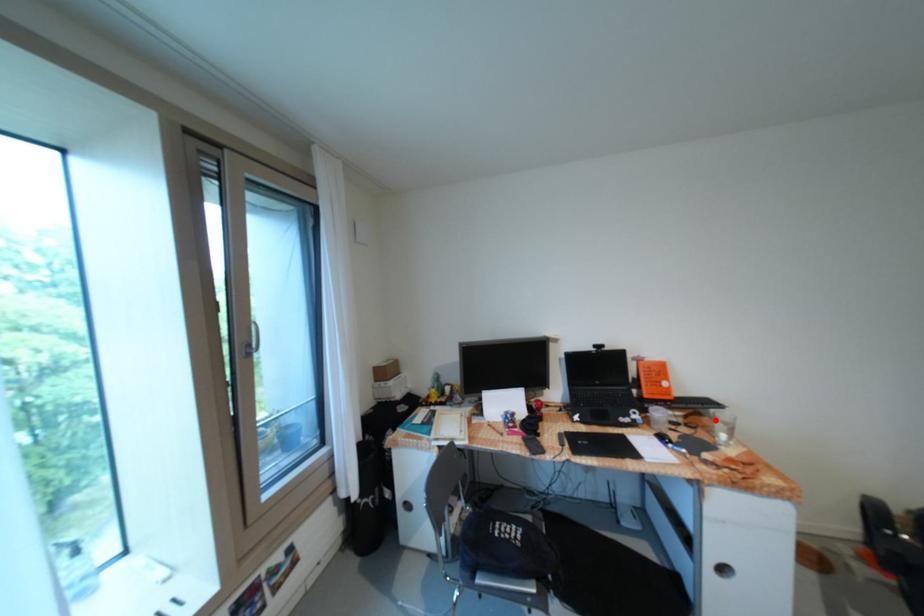
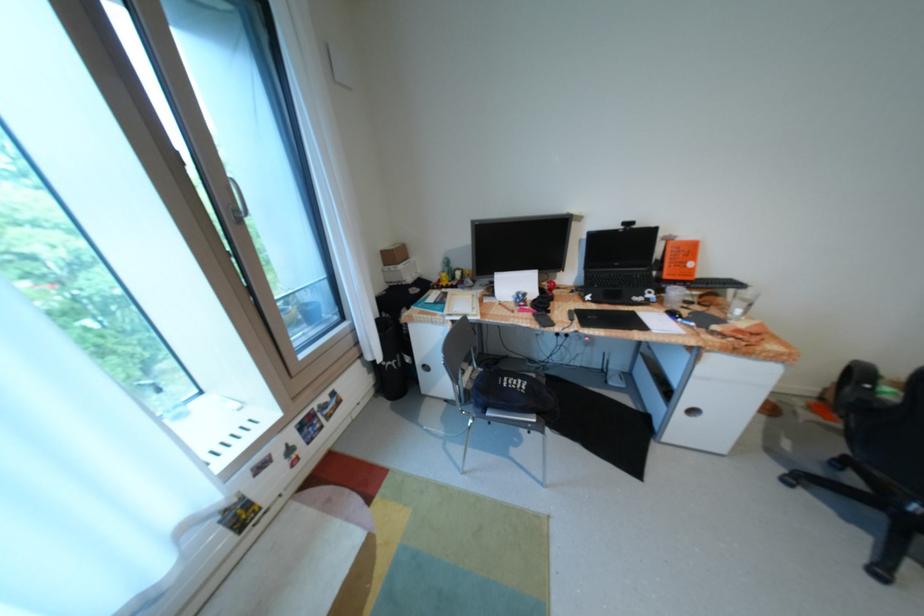
Question: I am providing you with two images of the same scene from different viewpoints. A red point is marked on the first image. At the location where the point appears in image 1, is it still visible in image 2?

Choices:
 (A) Yes
 (B) No

Answer: (A)